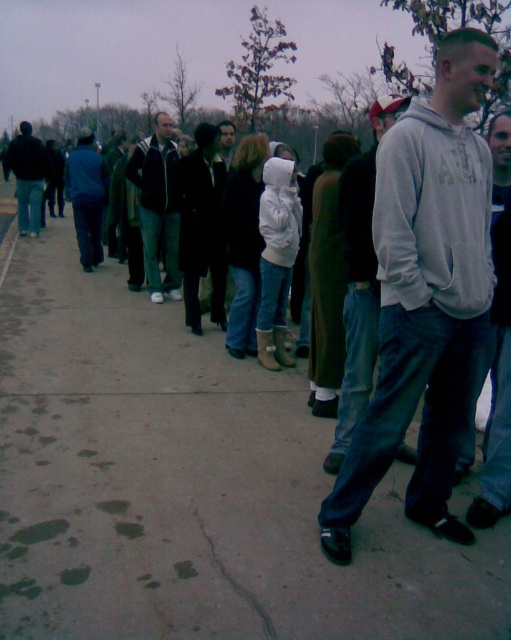
You are a photographer trying to capture a group photo of the gray sweatshirt at center and the dark gray jacket at center. Since you want both to be fully visible in the frame, which person should you position closer to the camera to ensure their full width fits?

The gray sweatshirt at center has a smaller width than the dark gray jacket at center. To ensure both are fully visible, position the gray sweatshirt at center closer to the camera so its smaller width can fit alongside the wider dark gray jacket at center in the frame.

You are a photographer trying to capture a group photo of the crowd. You notice two people wearing gray sweatshirt at center and dark gray jacket at center. Which clothing item would require more space to frame properly in your photo?

The dark gray jacket at center requires more space to frame properly in the photo since it occupies more space than the gray sweatshirt at center.